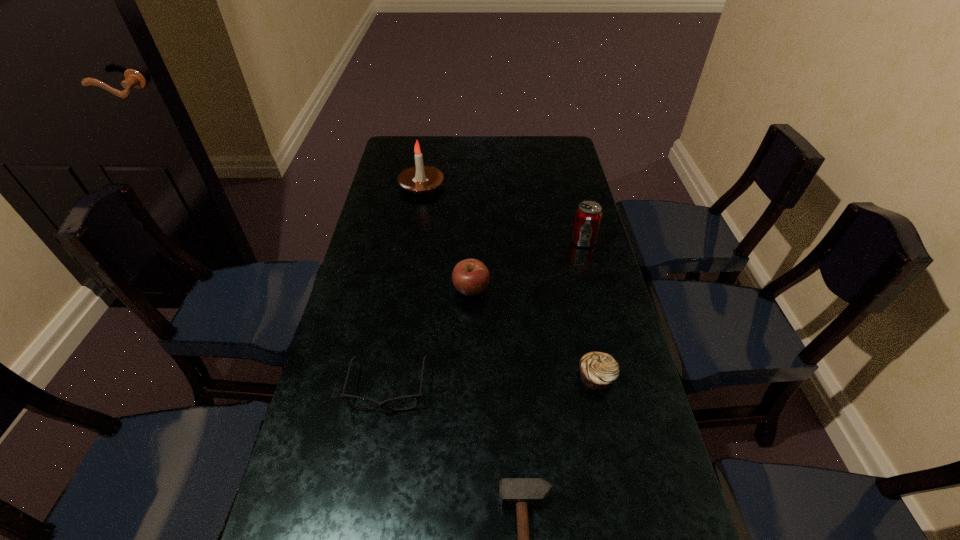
Locate an element on the screen. This screenshot has width=960, height=540. the tallest object is located at coordinates (420, 179).

At what (x,y) coordinates should I click in order to perform the action: click on the farthest object. Please return your answer as a coordinate pair (x, y). This screenshot has height=540, width=960. Looking at the image, I should click on point(420,179).

This screenshot has height=540, width=960. Identify the location of pop soda. (588, 215).

I want to click on the fifth nearest object, so click(588, 215).

Locate an element on the screen. The image size is (960, 540). the fourth object from right to left is located at coordinates (470, 277).

The image size is (960, 540). In order to click on the third tallest object in this screenshot , I will do `click(470, 277)`.

The image size is (960, 540). What are the coordinates of `the fourth tallest object` in the screenshot? It's located at (598, 370).

Find the location of `the fifth tallest object`. the fifth tallest object is located at coordinates (418, 396).

The width and height of the screenshot is (960, 540). In order to click on free region located on the back of the tallest object in this screenshot , I will do `click(428, 147)`.

The width and height of the screenshot is (960, 540). Identify the location of free space located 0.250m on the left of the fifth nearest object. (492, 241).